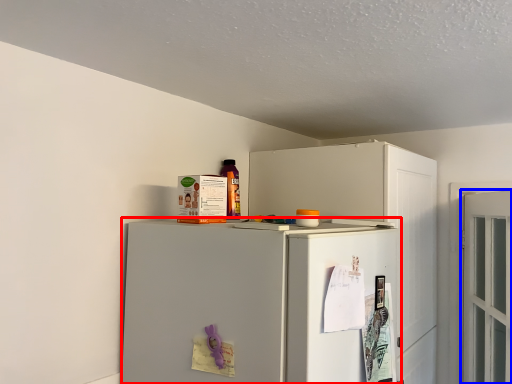
Question: Which object appears farthest to the camera in this image, refrigerator (highlighted by a red box) or door (highlighted by a blue box)?

Choices:
 (A) refrigerator
 (B) door

Answer: (B)